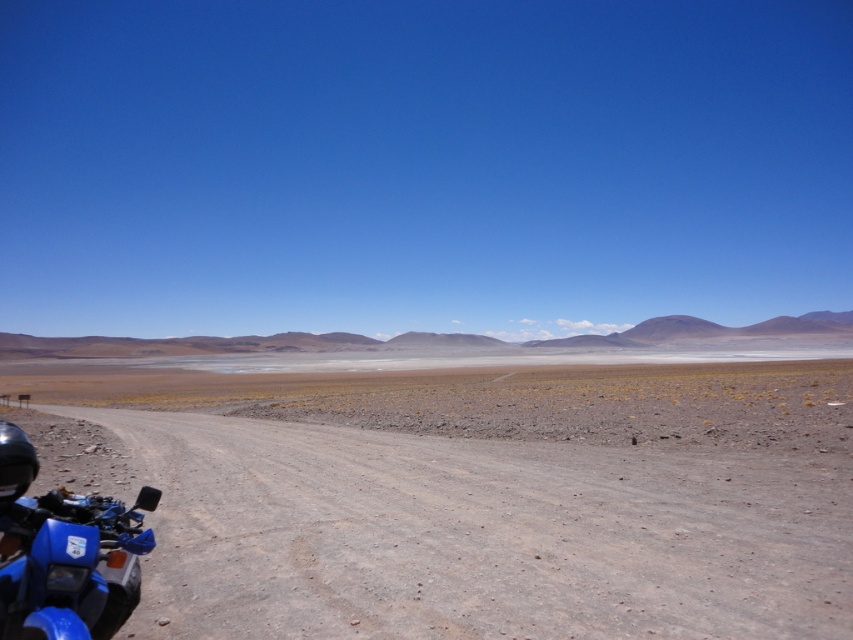
Question: Is blue gravel road at lower left below blue matte motorcycle at lower left?

Choices:
 (A) yes
 (B) no

Answer: (A)

Question: Which of the following is the closest to the observer?

Choices:
 (A) blue gravel road at lower left
 (B) blue matte motorcycle at lower left

Answer: (B)

Question: Among these objects, which one is nearest to the camera?

Choices:
 (A) blue matte motorcycle at lower left
 (B) blue gravel road at lower left

Answer: (A)

Question: Can you confirm if blue gravel road at lower left is positioned to the right of blue matte motorcycle at lower left?

Choices:
 (A) no
 (B) yes

Answer: (B)

Question: Does blue gravel road at lower left appear over blue matte motorcycle at lower left?

Choices:
 (A) no
 (B) yes

Answer: (A)